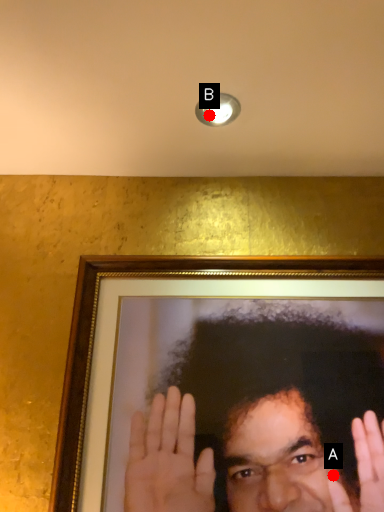
Question: Two points are circled on the image, labeled by A and B beside each circle. Which point is farther to the camera?

Choices:
 (A) A is further
 (B) B is further

Answer: (B)